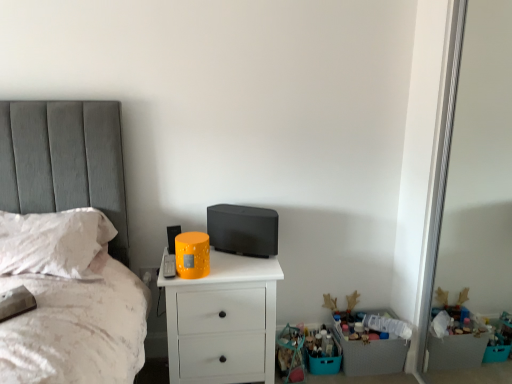
Question: Is plastic crate at lower right located outside white soft pillow at left?

Choices:
 (A) yes
 (B) no

Answer: (A)

Question: Does plastic crate at lower right have a lesser height compared to white soft pillow at left?

Choices:
 (A) yes
 (B) no

Answer: (B)

Question: From a real-world perspective, is plastic crate at lower right over white soft pillow at left?

Choices:
 (A) no
 (B) yes

Answer: (A)

Question: Is plastic crate at lower right at the right side of white soft pillow at left?

Choices:
 (A) yes
 (B) no

Answer: (A)

Question: Can you confirm if plastic crate at lower right is taller than white soft pillow at left?

Choices:
 (A) no
 (B) yes

Answer: (B)

Question: From the image's perspective, is white matte chest of drawers at center above or below white soft pillow at left?

Choices:
 (A) below
 (B) above

Answer: (A)

Question: Relative to white soft pillow at left, is white matte chest of drawers at center in front or behind?

Choices:
 (A) behind
 (B) front

Answer: (A)

Question: Is white matte chest of drawers at center situated inside white soft pillow at left or outside?

Choices:
 (A) inside
 (B) outside

Answer: (B)

Question: Is white matte chest of drawers at center taller or shorter than white soft pillow at left?

Choices:
 (A) short
 (B) tall

Answer: (B)

Question: From their relative heights in the image, would you say plastic crate at lower right is taller or shorter than white soft pillow at left?

Choices:
 (A) tall
 (B) short

Answer: (A)

Question: Relative to white soft pillow at left, is plastic crate at lower right in front or behind?

Choices:
 (A) front
 (B) behind

Answer: (B)

Question: Is plastic crate at lower right spatially inside white soft pillow at left, or outside of it?

Choices:
 (A) outside
 (B) inside

Answer: (A)

Question: Considering the positions of plastic crate at lower right and white soft pillow at left in the image, is plastic crate at lower right bigger or smaller than white soft pillow at left?

Choices:
 (A) big
 (B) small

Answer: (B)

Question: Is point (73, 213) closer or farther from the camera than point (202, 309)?

Choices:
 (A) closer
 (B) farther

Answer: (A)

Question: In the image, is white soft pillow at left on the left side or the right side of white matte chest of drawers at center?

Choices:
 (A) left
 (B) right

Answer: (A)